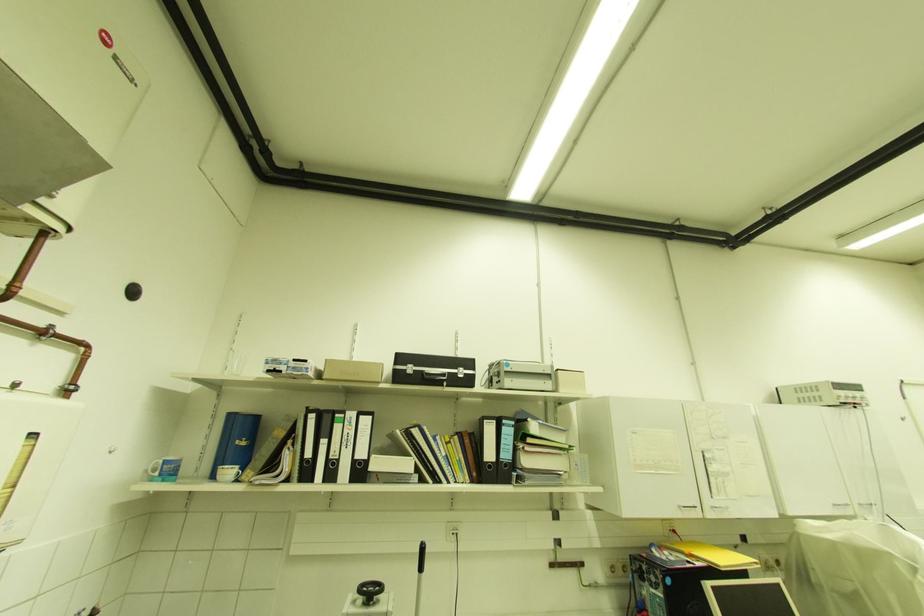
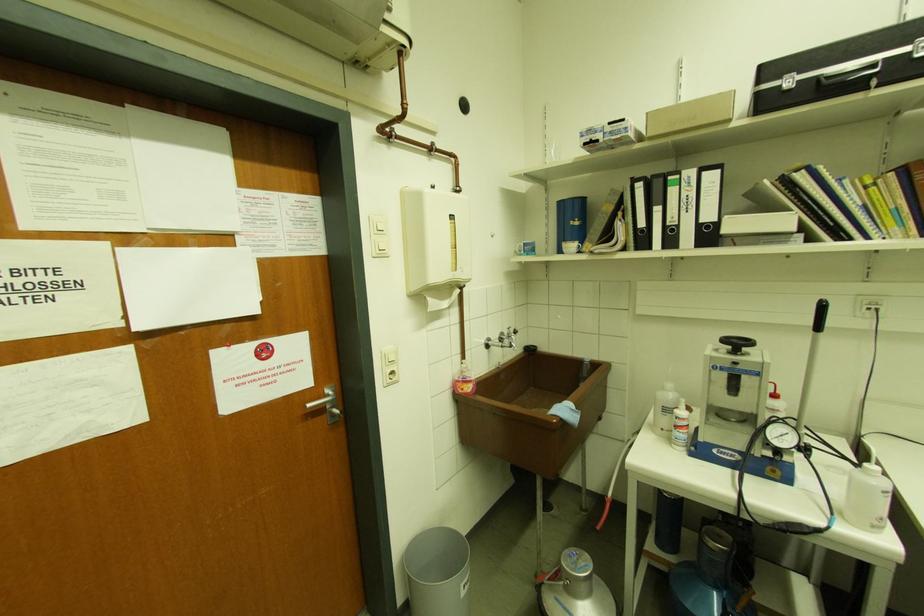
Find the pixel in the second image that matches point 383,589 in the first image.

(752, 344)